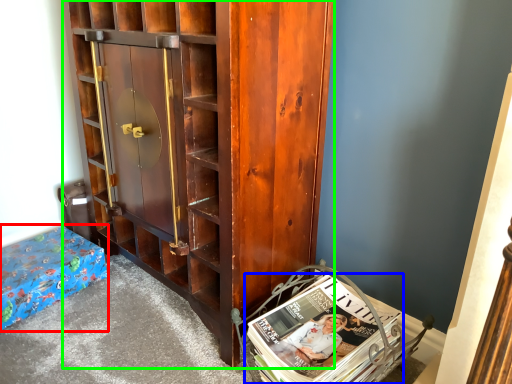
Question: Which object is the farthest from furniture (highlighted by a red box)? Choose among these: book (highlighted by a blue box) or cabinetry (highlighted by a green box).

Choices:
 (A) book
 (B) cabinetry

Answer: (A)